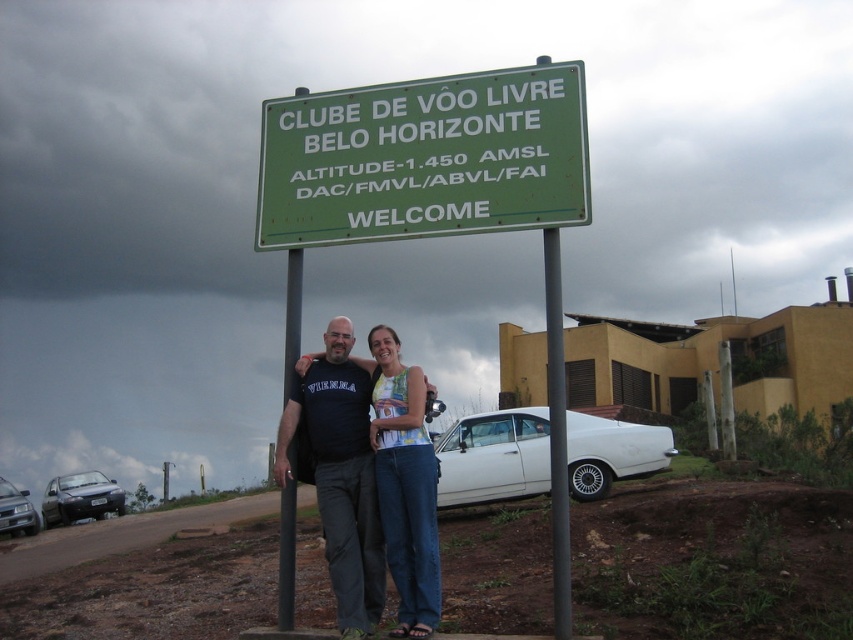
Between green plastic sign at center and black metal pole at center, which one is positioned lower?

black metal pole at center is lower down.

Does point (389, 227) lie behind point (277, 554)?

No, it is in front of (277, 554).

This screenshot has height=640, width=853. What do you see at coordinates (425, 157) in the screenshot?
I see `green plastic sign at center` at bounding box center [425, 157].

Find the location of a particular element. green plastic sign at center is located at coordinates (425, 157).

The width and height of the screenshot is (853, 640). What do you see at coordinates (340, 474) in the screenshot?
I see `black cotton shirt at center` at bounding box center [340, 474].

Who is lower down, black cotton shirt at center or gray metallic pole at center?

black cotton shirt at center is lower down.

Is point (309, 429) closer to viewer compared to point (567, 577)?

No, (309, 429) is behind (567, 577).

You are a GUI agent. You are given a task and a screenshot of the screen. Output one action in this format:
    pyautogui.click(x=<x>, y=<y>)
    Task: Click on the black cotton shirt at center
    
    Given the screenshot: What is the action you would take?
    pyautogui.click(x=340, y=474)

What do you see at coordinates (494, 458) in the screenshot?
I see `white glossy car at lower right` at bounding box center [494, 458].

Between white glossy car at lower right and matte black sedan at lower left, which one has less height?

white glossy car at lower right

This screenshot has width=853, height=640. What do you see at coordinates (494, 458) in the screenshot?
I see `white glossy car at lower right` at bounding box center [494, 458].

Where is `white glossy car at lower right`? white glossy car at lower right is located at coordinates (494, 458).